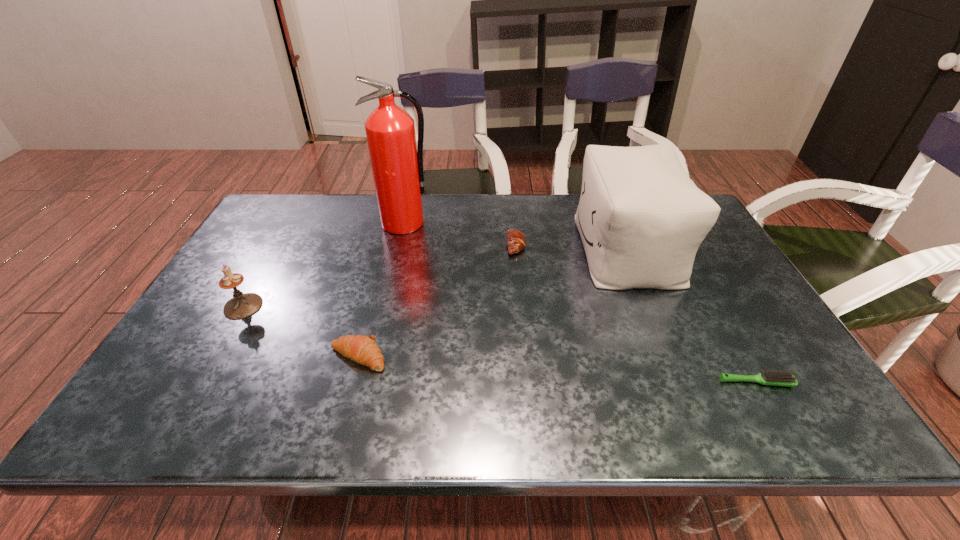
The width and height of the screenshot is (960, 540). Identify the location of vacant area that lies between the fifth farthest object and the fifth shortest object. (492, 302).

Find the location of a particular element. The width and height of the screenshot is (960, 540). free space between the third nearest object and the nearer crescent roll is located at coordinates (300, 332).

You are a GUI agent. You are given a task and a screenshot of the screen. Output one action in this format:
    pyautogui.click(x=<x>, y=<y>)
    Task: Click on the free space between the fourth shortest object and the second nearest object
    
    Given the screenshot: What is the action you would take?
    pyautogui.click(x=300, y=332)

Locate an element on the screen. Image resolution: width=960 pixels, height=540 pixels. free spot between the hairbrush and the candle holder is located at coordinates (500, 345).

Image resolution: width=960 pixels, height=540 pixels. Find the location of `blank region between the fourth farthest object and the nearest object`. blank region between the fourth farthest object and the nearest object is located at coordinates (500, 345).

At what (x,y) coordinates should I click in order to perform the action: click on blank region between the candle holder and the tallest object. Please return your answer as a coordinate pair (x, y). Looking at the image, I should click on (324, 265).

At what (x,y) coordinates should I click in order to perform the action: click on free space between the nearer crescent roll and the second tallest object. Please return your answer as a coordinate pair (x, y). Looking at the image, I should click on (492, 302).

The image size is (960, 540). What are the coordinates of `empty location between the fire extinguisher and the left crescent roll` in the screenshot? It's located at (381, 290).

I want to click on free space between the second tallest object and the candle holder, so click(x=435, y=277).

At what (x,y) coordinates should I click in order to perform the action: click on the third closest object to the third nearest object. Please return your answer as a coordinate pair (x, y). Looking at the image, I should click on (516, 241).